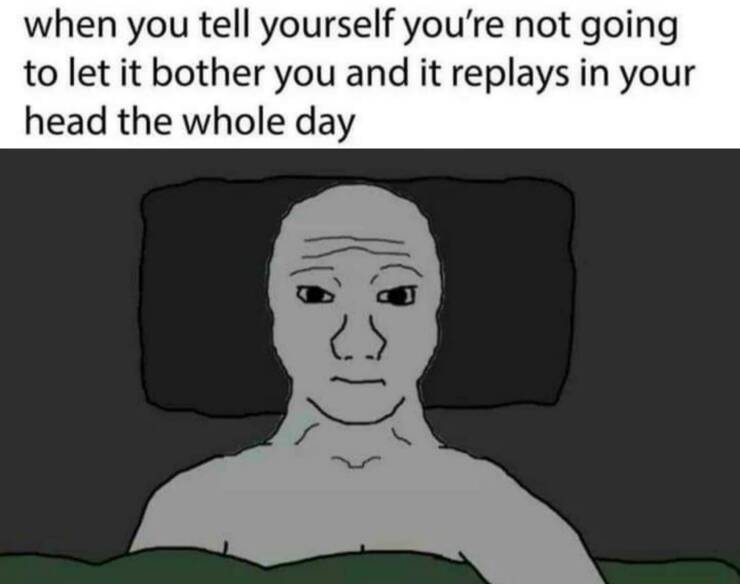
Find the location of a particular element. The image size is (740, 584). bed is located at coordinates (587, 342).